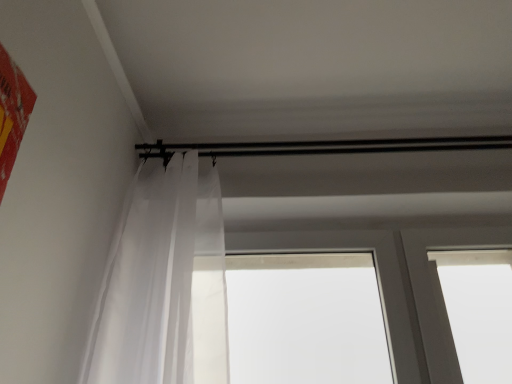
Question: Is point (205, 226) positioned closer to the camera than point (385, 251)?

Choices:
 (A) farther
 (B) closer

Answer: (B)

Question: Considering the relative positions of translucent fabric curtain at left and transparent plastic window at center in the image provided, is translucent fabric curtain at left to the left or to the right of transparent plastic window at center?

Choices:
 (A) right
 (B) left

Answer: (B)

Question: Is translucent fabric curtain at left inside or outside of transparent plastic window at center?

Choices:
 (A) inside
 (B) outside

Answer: (B)

Question: Considering the positions of transparent plastic window at center and translucent fabric curtain at left in the image, is transparent plastic window at center wider or thinner than translucent fabric curtain at left?

Choices:
 (A) wide
 (B) thin

Answer: (B)

Question: From the image's perspective, relative to translucent fabric curtain at left, is transparent plastic window at center above or below?

Choices:
 (A) above
 (B) below

Answer: (B)

Question: Is transparent plastic window at center to the left or to the right of translucent fabric curtain at left in the image?

Choices:
 (A) right
 (B) left

Answer: (A)

Question: From a real-world perspective, relative to translucent fabric curtain at left, is transparent plastic window at center vertically above or below?

Choices:
 (A) above
 (B) below

Answer: (B)